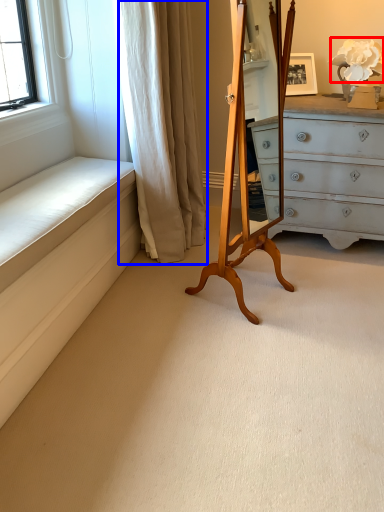
Question: Which point is further to the camera, flower (highlighted by a red box) or curtain (highlighted by a blue box)?

Choices:
 (A) flower
 (B) curtain

Answer: (A)